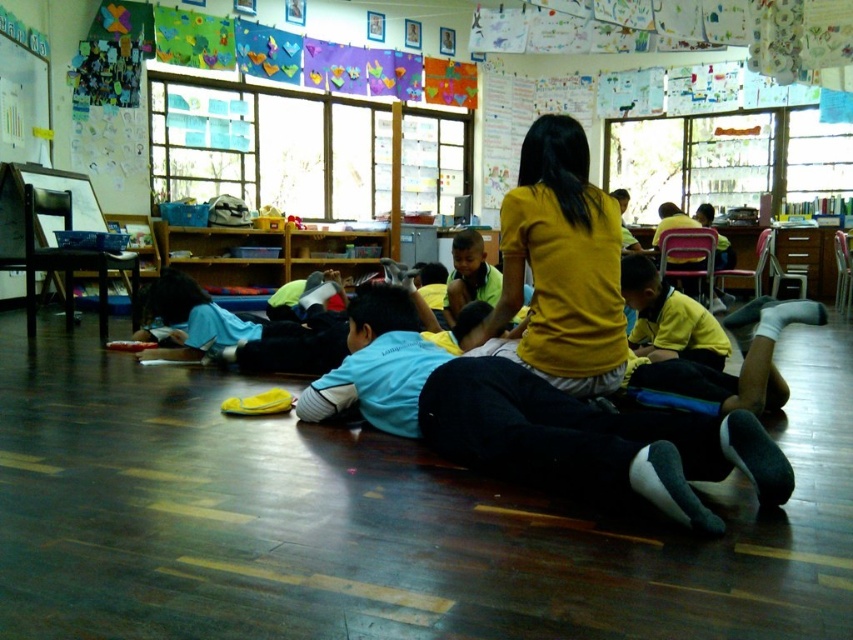
Question: Is blue fabric shirt at center positioned at the back of yellow matte shirt at center?

Choices:
 (A) yes
 (B) no

Answer: (B)

Question: Does blue fabric shirt at center lie behind yellow matte shirt at center?

Choices:
 (A) no
 (B) yes

Answer: (A)

Question: Which point is closer to the camera taking this photo?

Choices:
 (A) (628, 500)
 (B) (595, 252)

Answer: (A)

Question: Can you confirm if blue fabric shirt at center is positioned to the left of yellow matte shirt at center?

Choices:
 (A) no
 (B) yes

Answer: (B)

Question: Which point is closer to the camera?

Choices:
 (A) blue fabric shirt at center
 (B) yellow matte shirt at center

Answer: (A)

Question: Which object is closer to the camera taking this photo?

Choices:
 (A) blue fabric shirt at center
 (B) yellow matte shirt at center

Answer: (A)